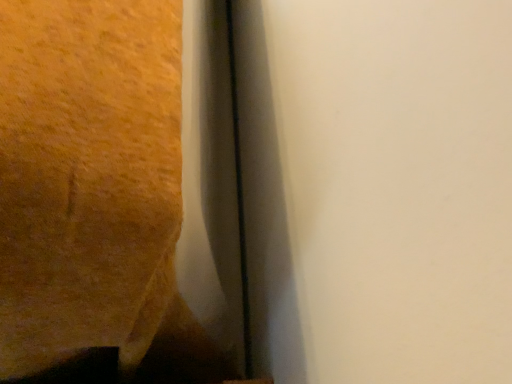
This screenshot has width=512, height=384. I want to click on matte brown bread at left, so click(x=84, y=171).

Measure the distance between matte brown bread at left and camera.

The distance of matte brown bread at left from camera is 20.52 centimeters.

What do you see at coordinates (84, 171) in the screenshot? The image size is (512, 384). I see `matte brown bread at left` at bounding box center [84, 171].

I want to click on matte brown bread at left, so click(x=84, y=171).